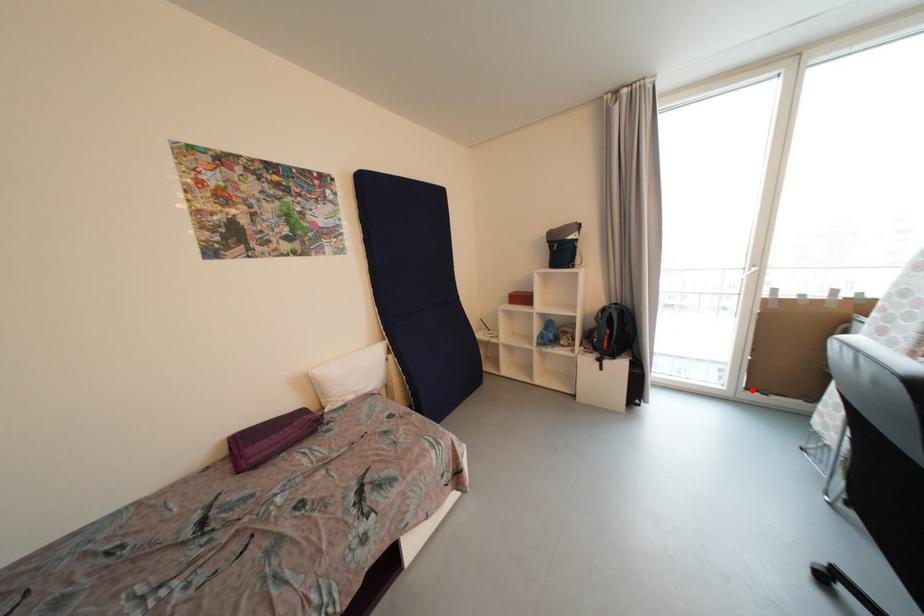
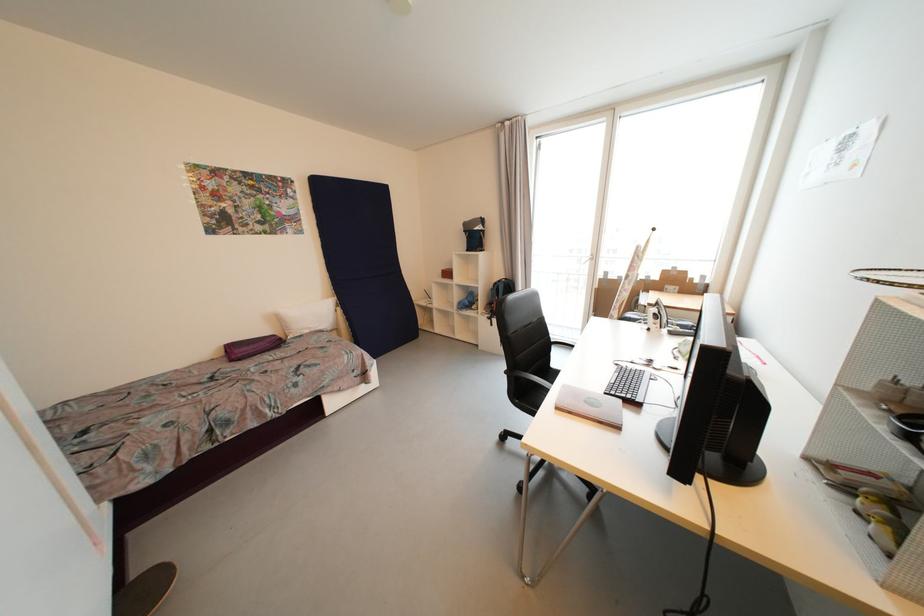
Question: I am providing you with two images of the same scene from different viewpoints. A red point is marked on the first image. Is the red point's position out of view in image 2?

Choices:
 (A) Yes
 (B) No

Answer: (A)